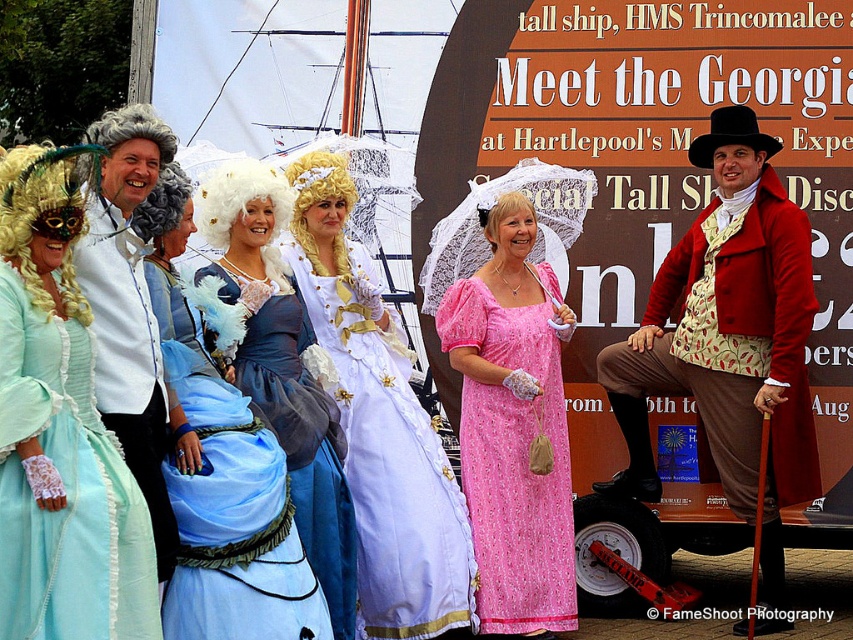
Question: Is gray curly wig at upper left bigger than gray curly wig at left?

Choices:
 (A) yes
 (B) no

Answer: (A)

Question: Which point is farther to the camera?

Choices:
 (A) red velvet coat at right
 (B) gray curly wig at left

Answer: (A)

Question: Can you confirm if light blue satin gown at center is positioned below gray curly wig at left?

Choices:
 (A) yes
 (B) no

Answer: (A)

Question: Does blue satin dress at center appear on the right side of gray curly wig at left?

Choices:
 (A) no
 (B) yes

Answer: (B)

Question: Which of the following is the closest to the observer?

Choices:
 (A) red velvet coat at right
 (B) gray curly wig at left

Answer: (B)

Question: Which point is farther from the camera taking this photo?

Choices:
 (A) (503, 195)
 (B) (155, 211)
 (C) (9, 234)

Answer: (A)